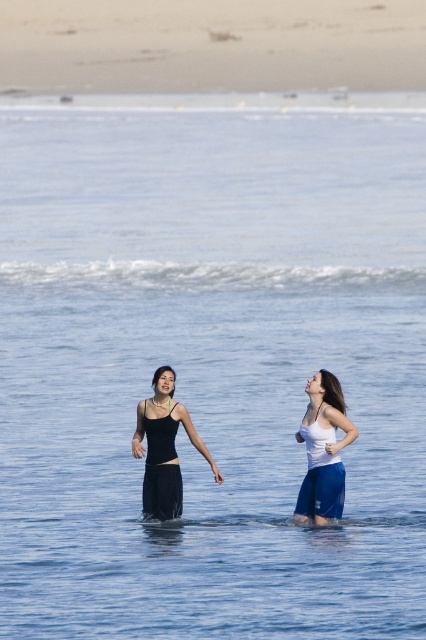
You are a photographer trying to capture a photo of the black matte dress at center and the smooth sand at upper center. If you want to include both in your frame, which direction should you move your camera to the left or right?

Since the smooth sand at upper center is to the left of the black matte dress at center, you should move your camera to the right to include both the smooth sand at upper center and the black matte dress at center in the frame.

You are a photographer who wants to capture a closeup of the black matte dress at center without the smooth sand at upper center being in the foreground. Based on the scene description, is this possible? Explain your reasoning.

The smooth sand at upper center is further to the viewer than the black matte dress at center, meaning the sand is closer to the camera. Therefore, it would be in the foreground, making it impossible to capture a closeup of the dress without the sand appearing in front of it.

You are a photographer trying to capture a closeup shot of two points in the scene. You want to focus on the point that is closer to you. Which point should you choose between point (313,467) and point (170,472)?

Point (313,467) is closer to the viewer than point (170,472), so you should choose point (313,467) for the closeup shot.